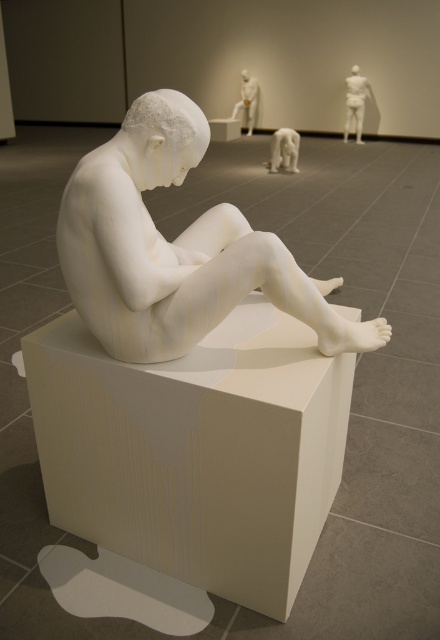
You are an art curator planning to move the white matte sculpture at center and the white glossy bear at center into a new exhibition space. The doorway to the new space has a width of 1.2 meters. Based on the information provided, can you determine if both items can pass through the doorway side by side?

The white matte sculpture at center might be wider than white glossy bear at center. Since their widths are uncertain, it is possible that combined they exceed the 1.2 meters doorway width. Further measurements are needed to confirm.

You are an art curator planning to install a new spotlight. The spotlight can only illuminate objects within a 0.350 radius from its position at point 0.450, 0.450. Will the white matte sculpture at center be illuminated by this spotlight?

The white matte sculpture at center is located at point (176, 248). The distance between the spotlight at (198, 288) and the sculpture is sqrt